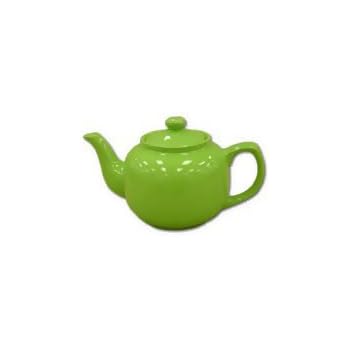
What are the coordinates of `handle` in the screenshot? It's located at (254, 149).